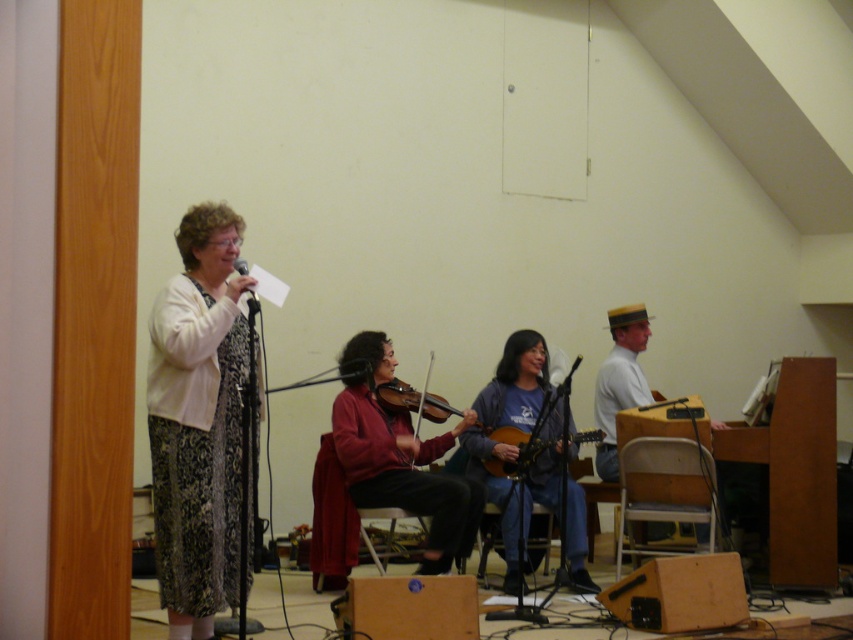
Question: Which of the following is the farthest from the observer?

Choices:
 (A) black matte microphone at upper left
 (B) red knit sweater at center

Answer: (B)

Question: Based on their relative distances, which object is nearer to the patterned fabric dress at left?

Choices:
 (A) wooden violin at center
 (B) black matte microphone at upper left

Answer: (B)

Question: Does patterned fabric dress at left have a smaller size compared to black matte microphone at upper left?

Choices:
 (A) no
 (B) yes

Answer: (A)

Question: Estimate the real-world distances between objects in this image. Which object is closer to the black matte microphone at upper left?

Choices:
 (A) patterned fabric dress at left
 (B) red knit sweater at center
 (C) blue cotton shirt at center
 (D) wooden violin at center

Answer: (A)

Question: Considering the relative positions of patterned fabric dress at left and black matte microphone at upper left in the image provided, where is patterned fabric dress at left located with respect to black matte microphone at upper left?

Choices:
 (A) below
 (B) above

Answer: (A)

Question: Can you confirm if patterned fabric dress at left is positioned to the left of red knit sweater at center?

Choices:
 (A) no
 (B) yes

Answer: (B)